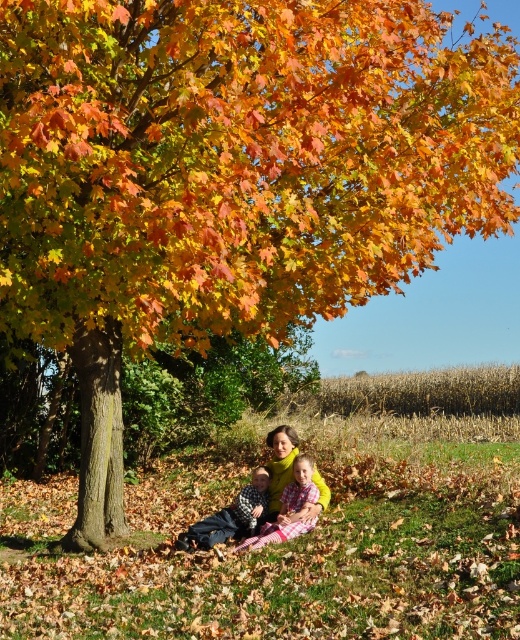
Looking at this image, you are standing in the autumn scene under the tree and want to place a small decoration between the two points marked as point (279,426) and point (245,529). Which point should you move towards to place the decoration closer to the viewer?

To place the decoration closer to the viewer, you should move towards point (279,426) because it is further to the viewer than point (245,529).

You are planning to place a small picnic basket on the ground between the yellow fabric at lower center and the matte black jacket at lower center. Given their sizes, which object should you place the basket closer to to ensure it doesn

Answer: The yellow fabric at lower center has a larger width than the matte black jacket at lower center. To ensure the basket fits comfortably, place it closer to the matte black jacket at lower center since there will be more space available on its narrower side.